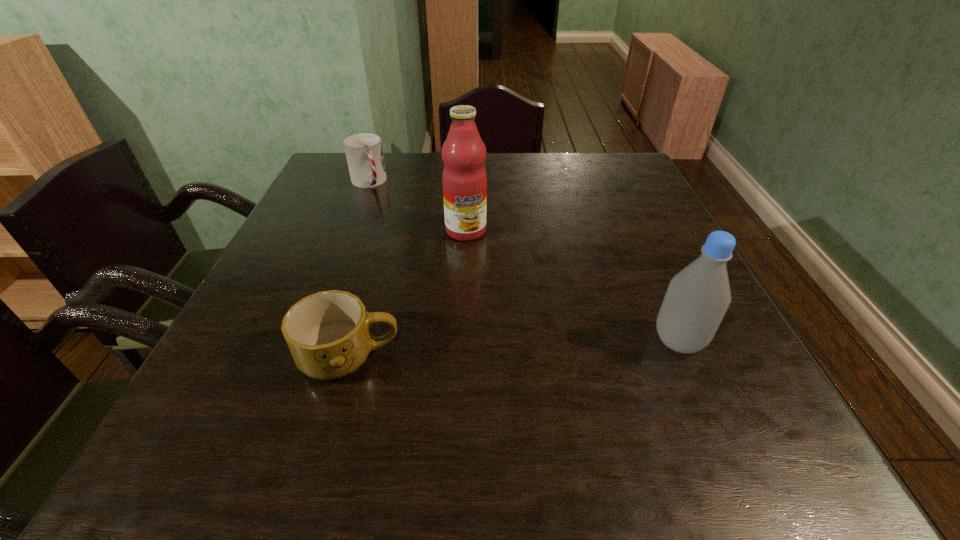
Locate an element on the screen. This screenshot has width=960, height=540. empty space between the mug and the cup is located at coordinates (359, 270).

The height and width of the screenshot is (540, 960). I want to click on vacant space that's between the rightmost object and the second object from right to left, so tap(572, 286).

Image resolution: width=960 pixels, height=540 pixels. In order to click on vacant space in between the second object from right to left and the cup in this screenshot , I will do `click(417, 206)`.

Find the location of a particular element. This screenshot has height=540, width=960. vacant space that's between the second farthest object and the third shortest object is located at coordinates (572, 286).

I want to click on free space between the fruit juice and the cup, so click(417, 206).

Where is `empty space that is in between the mug and the second tallest object`? empty space that is in between the mug and the second tallest object is located at coordinates (515, 349).

Identify the location of the second closest object to the cup. (328, 333).

Select which object appears as the second closest to the mug. Please provide its 2D coordinates. Your answer should be formatted as a tuple, i.e. [(x, y)], where the tuple contains the x and y coordinates of a point satisfying the conditions above.

[(697, 298)]

Find the location of a particular element. The height and width of the screenshot is (540, 960). free space that satisfies the following two spatial constraints: 1. on the front side of the cup; 2. on the right side of the rightmost object is located at coordinates (306, 341).

Where is `free location that satisfies the following two spatial constraints: 1. on the front side of the bottle; 2. on the right side of the third nearest object`? This screenshot has width=960, height=540. free location that satisfies the following two spatial constraints: 1. on the front side of the bottle; 2. on the right side of the third nearest object is located at coordinates (462, 341).